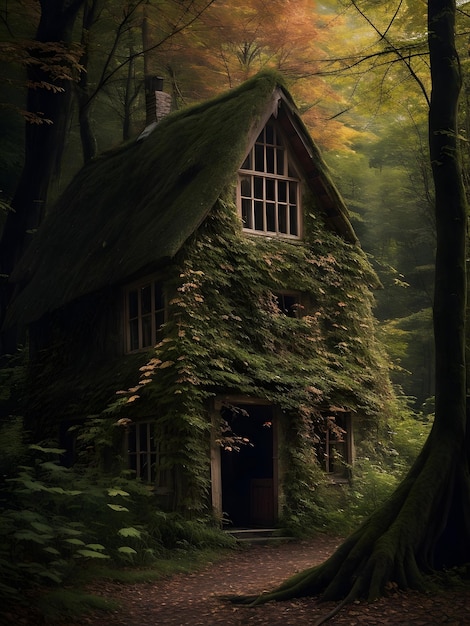
At what (x,y) coordinates should I click in order to perform the action: click on wooden window frame. Please return your answer as a coordinate pair (x, y). Image resolution: width=470 pixels, height=626 pixels. Looking at the image, I should click on (138, 433).